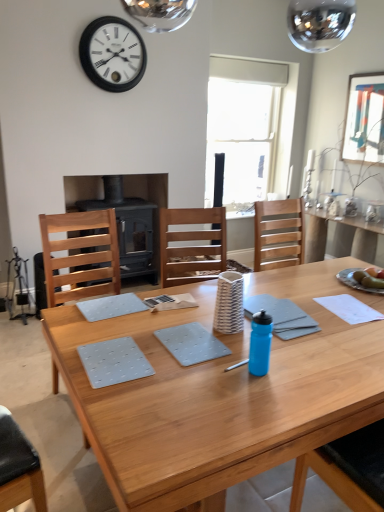
The height and width of the screenshot is (512, 384). What are the coordinates of `unoccupied space behind blue plastic water bottle at center` in the screenshot? It's located at (246, 348).